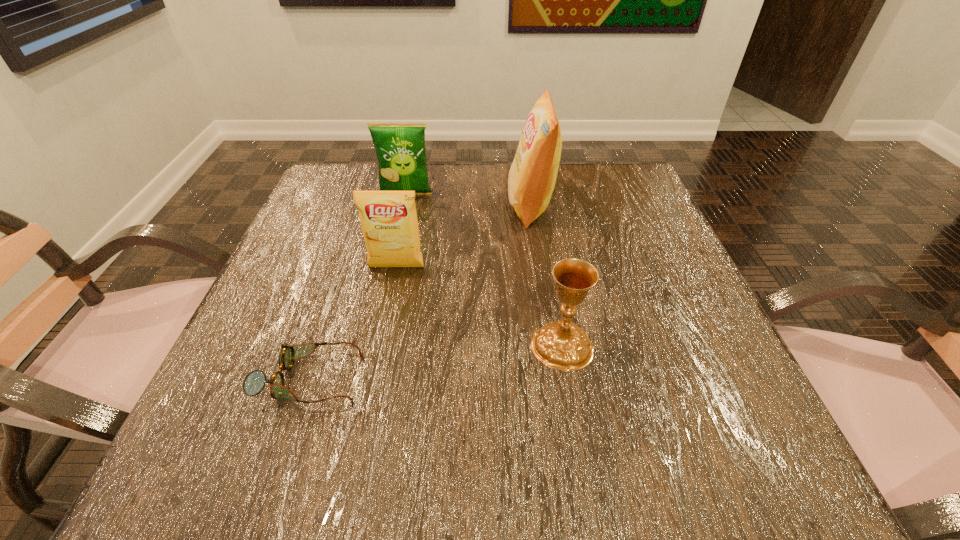
Choose which crisp (potato chip) is the second nearest neighbor to the nearest crisp (potato chip). Please provide its 2D coordinates. Your answer should be formatted as a tuple, i.e. [(x, y)], where the tuple contains the x and y coordinates of a point satisfying the conditions above.

[(400, 147)]

This screenshot has width=960, height=540. I want to click on crisp (potato chip) that stands as the second closest to the tallest object, so click(389, 222).

This screenshot has height=540, width=960. I want to click on vacant region that satisfies the following two spatial constraints: 1. on the front of the nearest crisp (potato chip) with the logo; 2. on the front-facing side of the spectacles, so click(x=373, y=379).

Find the location of a particular element. free spot that satisfies the following two spatial constraints: 1. on the front of the third farthest object with the logo; 2. on the front-facing side of the shortest object is located at coordinates (373, 379).

Identify the location of vacant space that satisfies the following two spatial constraints: 1. on the front-facing side of the rightmost crisp (potato chip); 2. on the front of the third nearest object with the logo. Image resolution: width=960 pixels, height=540 pixels. (540, 267).

The image size is (960, 540). I want to click on blank space that satisfies the following two spatial constraints: 1. on the back side of the chalice; 2. on the front-facing side of the tallest object, so click(539, 206).

This screenshot has height=540, width=960. Identify the location of blank area in the image that satisfies the following two spatial constraints: 1. on the front-facing side of the tallest object; 2. on the right side of the chalice. (551, 345).